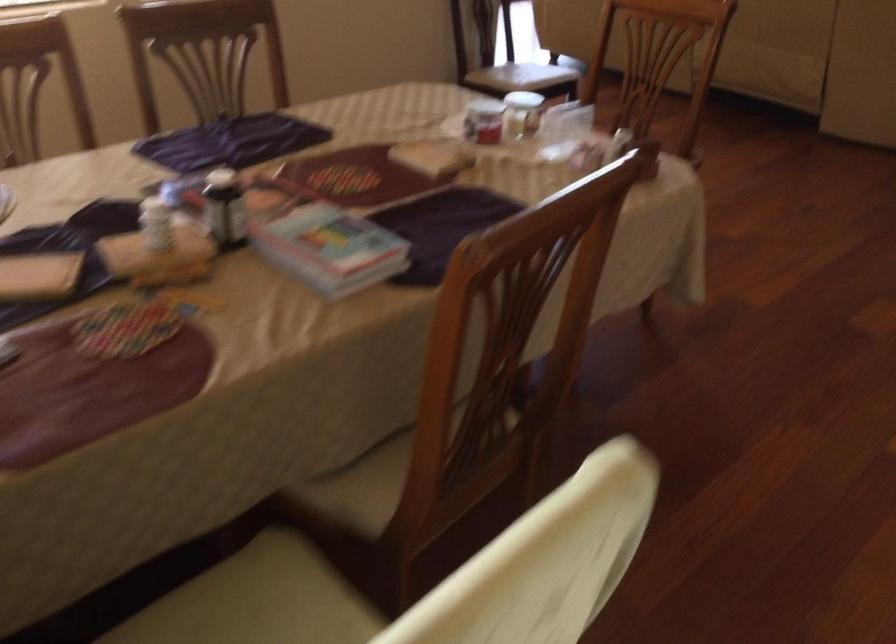
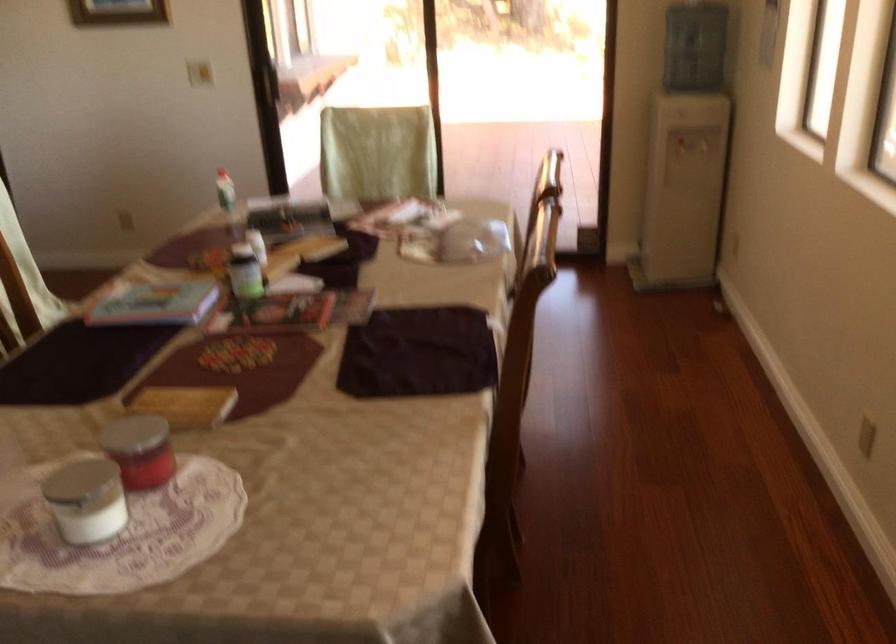
Locate, in the second image, the point that corresponds to the point at 225,207 in the first image.

(245, 272)